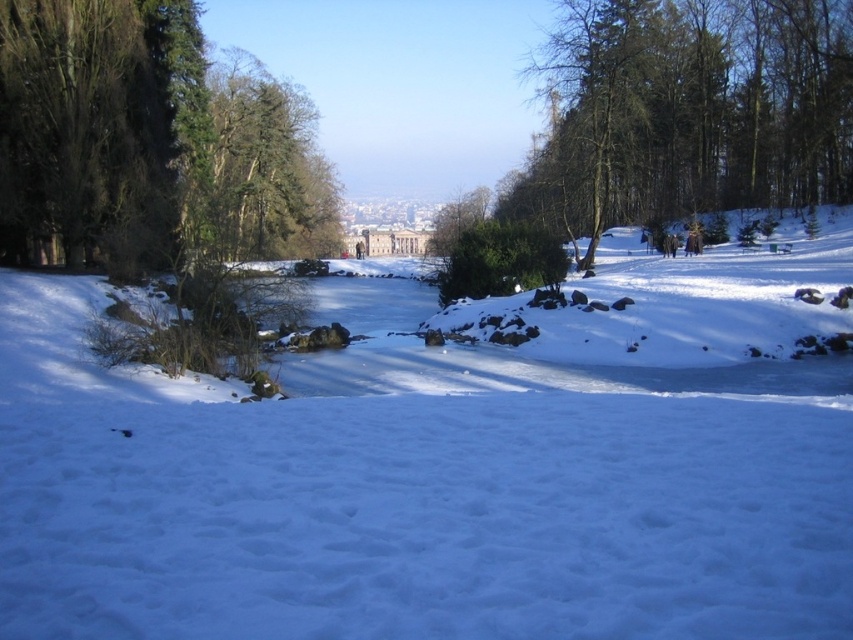
Between white fluffy snow at center and green matte tree at upper center, which one has less height?

Standing shorter between the two is white fluffy snow at center.

Is white fluffy snow at center above green matte tree at upper center?

No.

Does point (635, 369) lie in front of point (305, 216)?

Yes, it is in front of point (305, 216).

What are the coordinates of `white fluffy snow at center` in the screenshot? It's located at (445, 467).

Which is more to the left, white fluffy snow at center or green leafy tree at center?

Positioned to the left is white fluffy snow at center.

Is point (654, 317) less distant than point (718, 16)?

Yes, point (654, 317) is closer to viewer.

Image resolution: width=853 pixels, height=640 pixels. In order to click on white fluffy snow at center in this screenshot , I will do `click(445, 467)`.

Can you confirm if green leafy tree at center is taller than green matte tree at upper center?

Indeed, green leafy tree at center has a greater height compared to green matte tree at upper center.

Does green leafy tree at center have a smaller size compared to green matte tree at upper center?

Incorrect, green leafy tree at center is not smaller in size than green matte tree at upper center.

Where is `green leafy tree at center`? The height and width of the screenshot is (640, 853). green leafy tree at center is located at coordinates (688, 113).